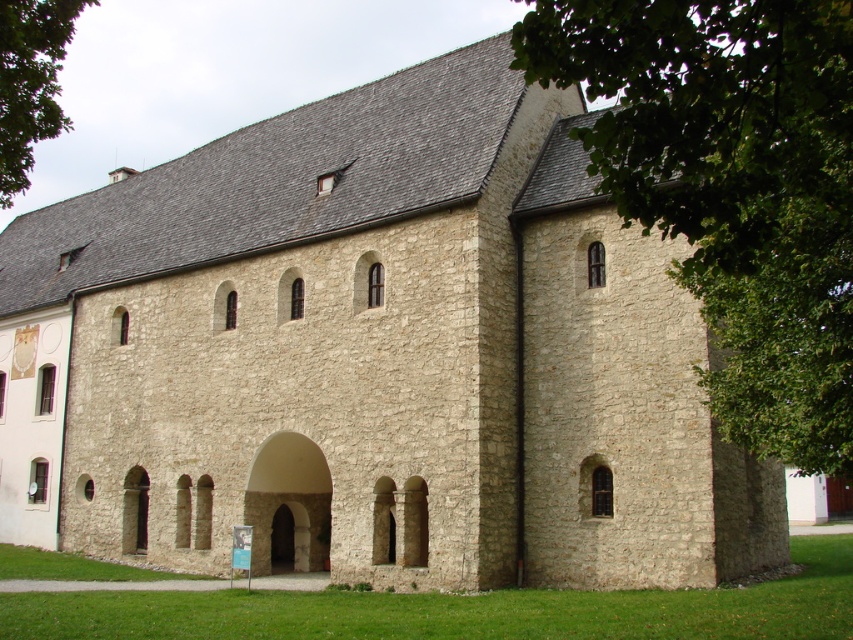
Question: Is green leafy tree at upper left to the left of stone archway at center from the viewer's perspective?

Choices:
 (A) yes
 (B) no

Answer: (A)

Question: Which object is positioned farthest from the green leafy tree at upper right?

Choices:
 (A) stone archway at center
 (B) green leafy tree at upper left

Answer: (A)

Question: Which of the following is the farthest from the observer?

Choices:
 (A) (676, 32)
 (B) (30, 60)
 (C) (300, 481)

Answer: (C)

Question: Is green leafy tree at upper right bigger than stone archway at center?

Choices:
 (A) no
 (B) yes

Answer: (B)

Question: Is green leafy tree at upper right further to camera compared to stone archway at center?

Choices:
 (A) yes
 (B) no

Answer: (B)

Question: Which object is positioned closest to the green leafy tree at upper right?

Choices:
 (A) green leafy tree at upper left
 (B) stone archway at center

Answer: (A)